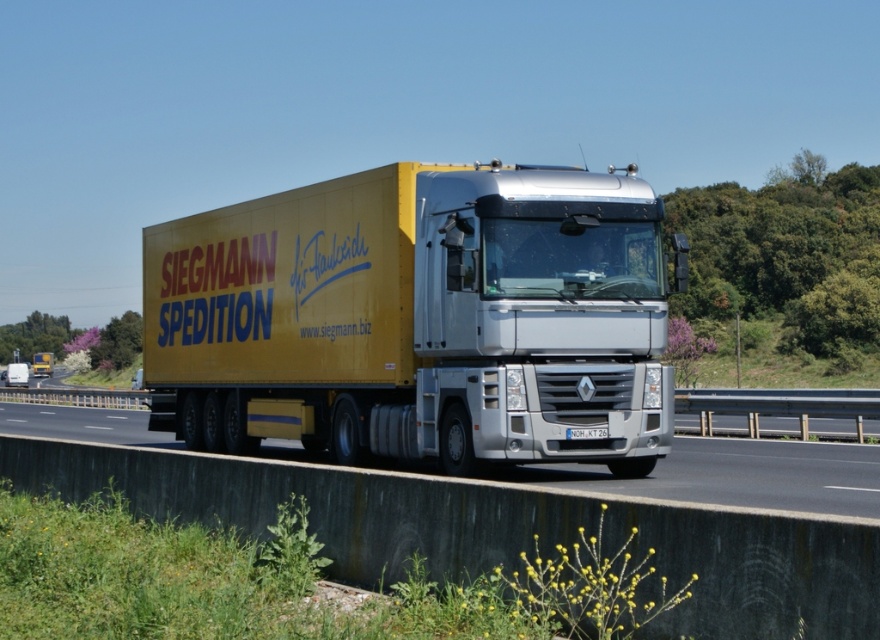
Does point (444, 253) come farther from viewer compared to point (59, 436)?

No, (444, 253) is in front of (59, 436).

Is point (671, 378) positioned before point (82, 438)?

That is True.

Who is more forward, (411, 417) or (592, 477)?

Point (411, 417) is more forward.

The image size is (880, 640). I want to click on yellow matte trailer truck at center, so click(418, 317).